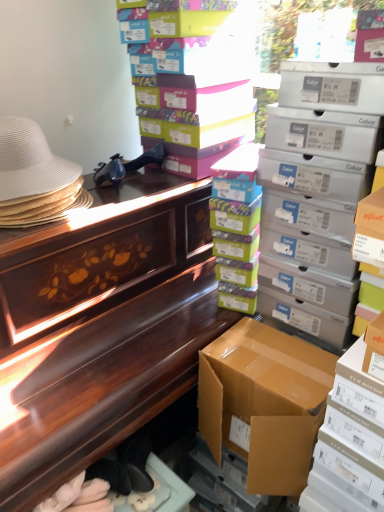
This screenshot has width=384, height=512. Find the location of `free space above brown cardboard box at lower right, the 2th box in the bottom-to-top sequence (from a real-world perspective)`. free space above brown cardboard box at lower right, the 2th box in the bottom-to-top sequence (from a real-world perspective) is located at coordinates (283, 369).